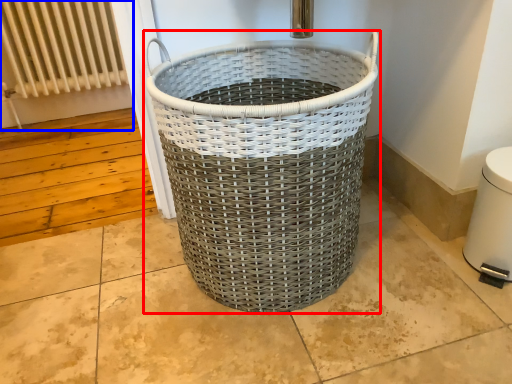
Question: Which object appears farthest to the camera in this image, waste container (highlighted by a red box) or radiator (highlighted by a blue box)?

Choices:
 (A) waste container
 (B) radiator

Answer: (B)